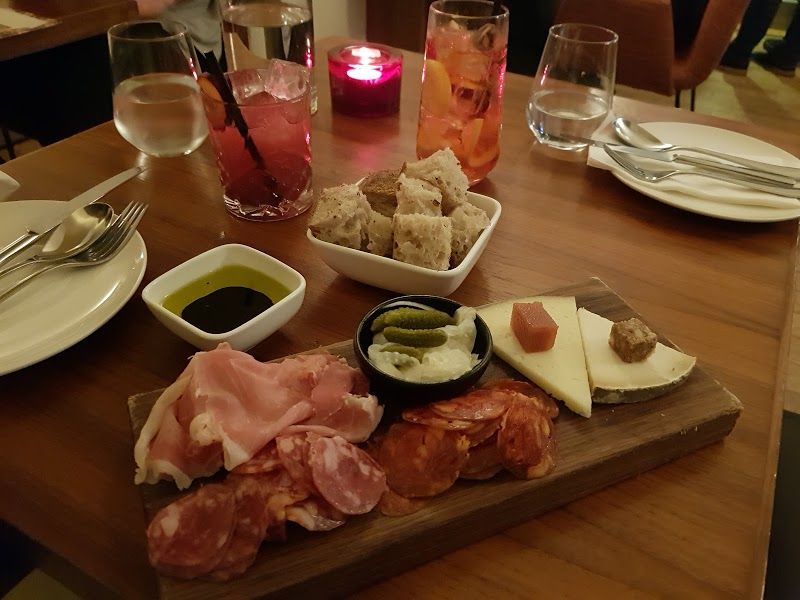
Identify the location of chair. (650, 69), (686, 61).